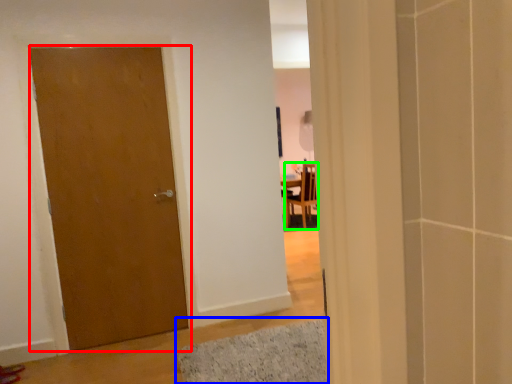
Question: Considering the real-world distances, which object is closest to door (highlighted by a red box)? bath mat (highlighted by a blue box) or chair (highlighted by a green box).

Choices:
 (A) bath mat
 (B) chair

Answer: (A)